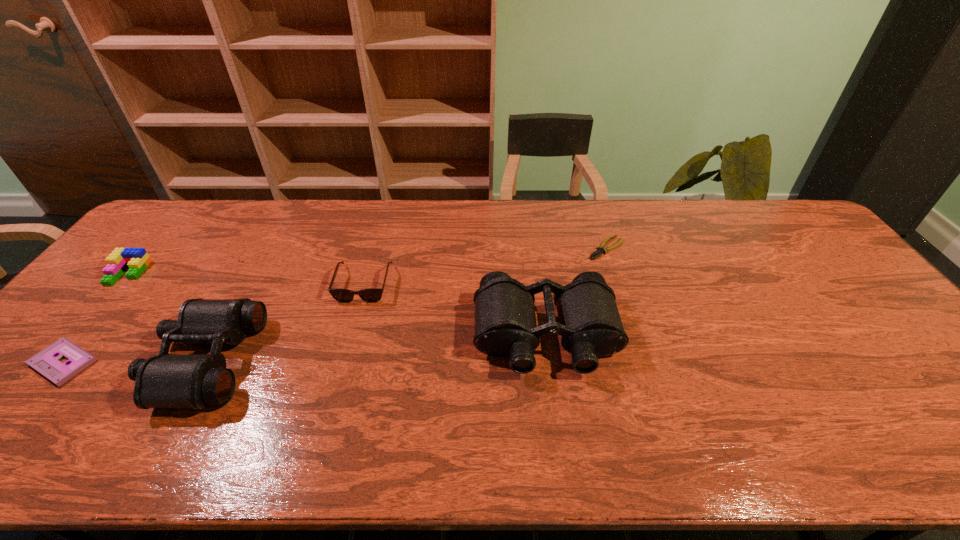
The image size is (960, 540). I want to click on videotape at the left edge, so click(x=46, y=362).

You are a GUI agent. You are given a task and a screenshot of the screen. Output one action in this format:
    pyautogui.click(x=<x>, y=<y>)
    Task: Click on the object located at the near left corner
    This screenshot has width=960, height=540.
    Given the screenshot: What is the action you would take?
    pyautogui.click(x=46, y=362)

The image size is (960, 540). What are the coordinates of `free space at the far edge of the desktop` in the screenshot? It's located at click(x=205, y=224).

Image resolution: width=960 pixels, height=540 pixels. What are the coordinates of `blank space at the near edge of the desktop` in the screenshot? It's located at (838, 411).

The height and width of the screenshot is (540, 960). Identify the location of blank area at the left edge. (108, 344).

What are the coordinates of `free space between the second shortest object and the Lego` in the screenshot? It's located at (96, 318).

The height and width of the screenshot is (540, 960). I want to click on free space between the sunglasses and the second tallest object, so click(284, 322).

Locate an element on the screen. empty space that is in between the fifth tallest object and the Lego is located at coordinates (96, 318).

Find the location of a particular element. The image size is (960, 540). free space between the Lego and the fourth object from right to left is located at coordinates (166, 316).

Image resolution: width=960 pixels, height=540 pixels. Identify the location of vacant space that's between the taller binoculars and the fourth object from right to left. click(375, 348).